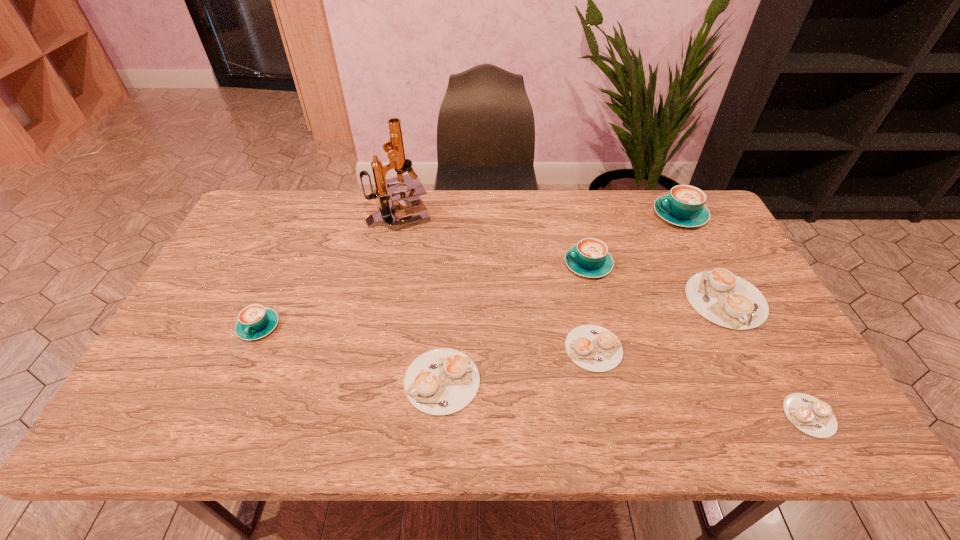
Find the location of a particular element. the tallest object is located at coordinates (385, 189).

This screenshot has width=960, height=540. Find the location of `gold microscope`. gold microscope is located at coordinates (385, 189).

Find the location of a particular element. This screenshot has height=540, width=960. the seventh shortest object is located at coordinates (684, 206).

Image resolution: width=960 pixels, height=540 pixels. Identify the location of the farthest cappuccino. (684, 206).

At what (x,y) coordinates should I click in order to perform the action: click on the second nearest turquoise cappuccino. Please return your answer as a coordinate pair (x, y). Image resolution: width=960 pixels, height=540 pixels. Looking at the image, I should click on (589, 258).

This screenshot has height=540, width=960. In order to click on the second turquoise cappuccino from left to right in this screenshot , I will do `click(589, 258)`.

In order to click on the fourth tallest object in this screenshot , I will do `click(255, 321)`.

The image size is (960, 540). I want to click on the nearest turquoise cappuccino, so click(255, 321).

Identify the location of the biggest white cappuccino. The height and width of the screenshot is (540, 960). (721, 297).

You are a GUI agent. You are given a task and a screenshot of the screen. Output one action in this format:
    pyautogui.click(x=<x>, y=<y>)
    Task: Click on the fifth tallest object
    This screenshot has height=540, width=960.
    Given the screenshot: What is the action you would take?
    point(721,297)